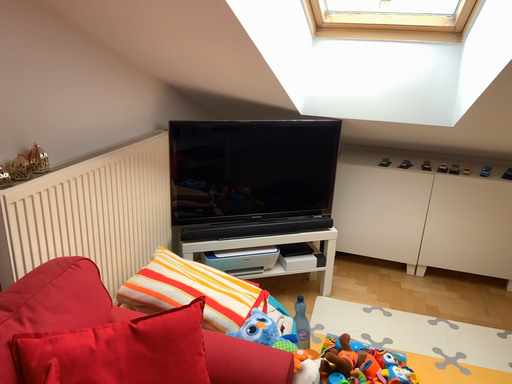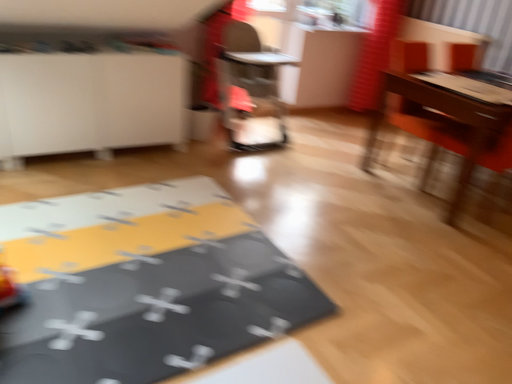
Question: How did the camera likely rotate when shooting the video?

Choices:
 (A) rotated downward
 (B) rotated upward

Answer: (A)